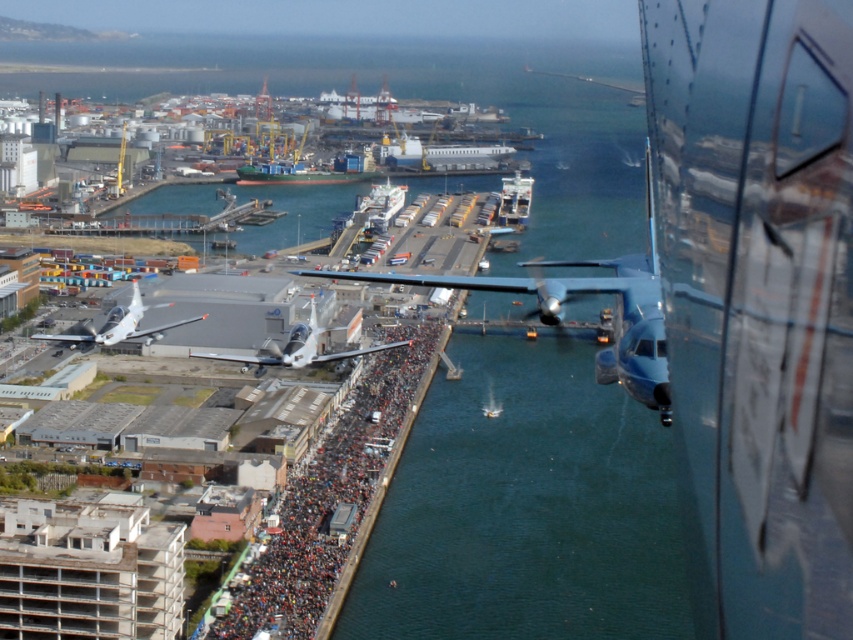
You are a pilot preparing for takeoff and notice the dark gray concrete crowd at center and the white glossy airplane at center in your view. Which object is closer to the ground?

The dark gray concrete crowd at center is below the white glossy airplane at center, so the crowd is closer to the ground than the airplane.

You are a drone operator planning to fly a drone from the helicopter to a point near the crowd. The helicopter is at the foreground. You need to pass through two points marked as point 1 at (x=465, y=618) and point 2 at (x=292, y=355). Which point should you reach first to ensure the drone follows the correct path towards the crowd?

You should reach point 2 at (x=292, y=355) first because point 1 at (x=465, y=618) is behind it. Since the crowd is on the left side of the image, the path should start from the closer point to the helicopter and move towards the farther point to approach the crowd correctly.

You are a pilot preparing to land your plane in this port area. You see the white glossy airplane at center and the silver metallic airplane at lower left. Which airplane is positioned lower in the sky from your perspective?

The white glossy airplane at center is positioned lower in the sky than the silver metallic airplane at lower left from your perspective.